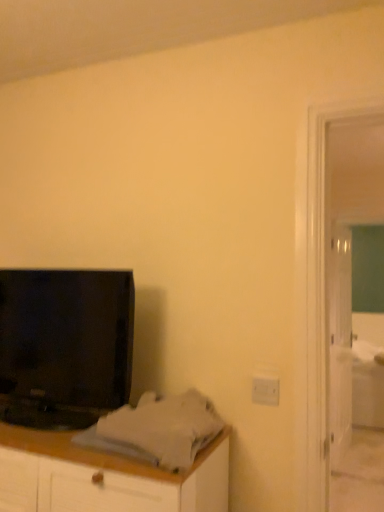
Question: Does white glossy door at right touch green glass screen door at right?

Choices:
 (A) no
 (B) yes

Answer: (A)

Question: Can you confirm if white glossy door at right is smaller than green glass screen door at right?

Choices:
 (A) no
 (B) yes

Answer: (A)

Question: Does white glossy door at right contain green glass screen door at right?

Choices:
 (A) no
 (B) yes

Answer: (A)

Question: Is white glossy door at right not near green glass screen door at right?

Choices:
 (A) no
 (B) yes

Answer: (B)

Question: Can you confirm if white glossy door at right is wider than green glass screen door at right?

Choices:
 (A) yes
 (B) no

Answer: (B)

Question: In terms of size, does green glass screen door at right appear bigger or smaller than white glossy door at right?

Choices:
 (A) small
 (B) big

Answer: (A)

Question: From a real-world perspective, is green glass screen door at right positioned above or below white glossy door at right?

Choices:
 (A) above
 (B) below

Answer: (A)

Question: Considering the positions of point (324, 489) and point (331, 338), is point (324, 489) closer or farther from the camera than point (331, 338)?

Choices:
 (A) closer
 (B) farther

Answer: (A)

Question: In terms of height, does green glass screen door at right look taller or shorter compared to white glossy door at right?

Choices:
 (A) tall
 (B) short

Answer: (A)

Question: Is green glass screen door at right spatially inside white fabric bed at right, or outside of it?

Choices:
 (A) inside
 (B) outside

Answer: (B)

Question: Is green glass screen door at right taller or shorter than white fabric bed at right?

Choices:
 (A) short
 (B) tall

Answer: (B)

Question: From the image's perspective, is green glass screen door at right positioned above or below white fabric bed at right?

Choices:
 (A) below
 (B) above

Answer: (B)

Question: Relative to white fabric bed at right, is green glass screen door at right in front or behind?

Choices:
 (A) front
 (B) behind

Answer: (A)

Question: Is white glossy door at right inside the boundaries of green glass screen door at right, or outside?

Choices:
 (A) inside
 (B) outside

Answer: (B)

Question: In terms of width, does white glossy door at right look wider or thinner when compared to green glass screen door at right?

Choices:
 (A) thin
 (B) wide

Answer: (A)